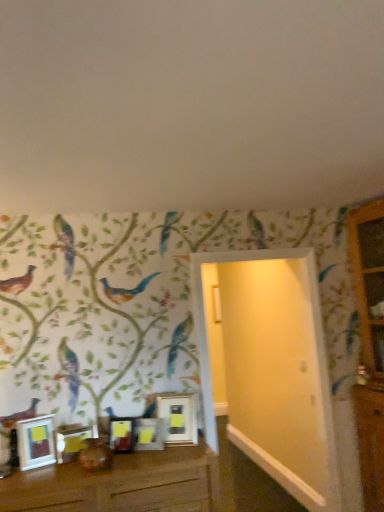
What is the approximate height of metallic silver frame at center, which ranks as the 4th picture frame in left-to-right order?

metallic silver frame at center, which ranks as the 4th picture frame in left-to-right order, is 9.89 inches in height.

The height and width of the screenshot is (512, 384). What are the coordinates of `metallic silver frame at center, which ranks as the 2th picture frame in right-to-left order` in the screenshot? It's located at (149, 434).

Describe the element at coordinates (72, 441) in the screenshot. I see `matte silver picture frame at lower left, which ranks as the second picture frame in left-to-right order` at that location.

Where is `brown wooden table at lower center`? This screenshot has width=384, height=512. brown wooden table at lower center is located at coordinates (121, 484).

Where is `metallic silver picture frame at center, the 1th picture frame viewed from the right`? This screenshot has height=512, width=384. metallic silver picture frame at center, the 1th picture frame viewed from the right is located at coordinates click(178, 418).

Is matte silver picture frame at lower left, which ranks as the second picture frame in left-to-right order, wider than white glossy picture frame at lower left, acting as the 5th picture frame starting from the right?

Incorrect, the width of matte silver picture frame at lower left, which ranks as the second picture frame in left-to-right order, does not surpass that of white glossy picture frame at lower left, acting as the 5th picture frame starting from the right.

Which is closer, (68, 436) or (28, 466)?

Point (68, 436).

Can white glossy picture frame at lower left, the 1th picture frame positioned from the left, be found inside matte silver picture frame at lower left, which ranks as the second picture frame in left-to-right order?

No, white glossy picture frame at lower left, the 1th picture frame positioned from the left, is not inside matte silver picture frame at lower left, which ranks as the second picture frame in left-to-right order.

Between wooden dresser at right and matte brown vase at center, which one has more height?

wooden dresser at right is taller.

Find the location of `vase in front of the wooden dresser at right`. vase in front of the wooden dresser at right is located at coordinates (95, 455).

From the image's perspective, is wooden dresser at right positioned above or below matte brown vase at center?

From the image's perspective, wooden dresser at right appears above matte brown vase at center.

From the image's perspective, is metallic silver frame at center, which ranks as the 2th picture frame in right-to-left order, located above or below white wooden door at center?

From the image's perspective, metallic silver frame at center, which ranks as the 2th picture frame in right-to-left order, appears below white wooden door at center.

Is point (136, 447) closer to viewer compared to point (327, 441)?

Yes, it is.

In order to click on door located on the right of metallic silver frame at center, which ranks as the 2th picture frame in right-to-left order in this screenshot , I will do `click(285, 375)`.

Are metallic silver frame at center, which ranks as the 4th picture frame in left-to-right order, and white wooden door at center making contact?

metallic silver frame at center, which ranks as the 4th picture frame in left-to-right order, is not next to white wooden door at center, and they're not touching.

Would you consider matte brown vase at center to be distant from matte silver picture frame at center, which is the 3th picture frame in right-to-left order?

No, matte brown vase at center is not far away from matte silver picture frame at center, which is the 3th picture frame in right-to-left order.

Considering the points (85, 454) and (116, 422), which point is in front, point (85, 454) or point (116, 422)?

The point (85, 454) is closer.

Considering the sizes of objects matte brown vase at center and matte silver picture frame at center, arranged as the 3th picture frame when viewed from the left, in the image provided, who is taller, matte brown vase at center or matte silver picture frame at center, arranged as the 3th picture frame when viewed from the left,?

matte silver picture frame at center, arranged as the 3th picture frame when viewed from the left.

From the image's perspective, is matte brown vase at center above or below white glossy picture frame at lower left, the 1th picture frame positioned from the left?

Based on their image positions, matte brown vase at center is located beneath white glossy picture frame at lower left, the 1th picture frame positioned from the left.

Between matte brown vase at center and white glossy picture frame at lower left, the 1th picture frame positioned from the left, which one has larger size?

white glossy picture frame at lower left, the 1th picture frame positioned from the left.

Is matte brown vase at center positioned with its back to white glossy picture frame at lower left, the 1th picture frame positioned from the left?

No, matte brown vase at center is not facing away from white glossy picture frame at lower left, the 1th picture frame positioned from the left.

From a real-world perspective, who is located higher, matte silver picture frame at center, arranged as the 3th picture frame when viewed from the left, or white glossy picture frame at lower left, acting as the 5th picture frame starting from the right?

white glossy picture frame at lower left, acting as the 5th picture frame starting from the right, is physically above.

Would you say matte silver picture frame at center, arranged as the 3th picture frame when viewed from the left, is inside or outside white glossy picture frame at lower left, the 1th picture frame positioned from the left?

matte silver picture frame at center, arranged as the 3th picture frame when viewed from the left, exists outside the volume of white glossy picture frame at lower left, the 1th picture frame positioned from the left.

From the image's perspective, is matte silver picture frame at center, which is the 3th picture frame in right-to-left order, below white glossy picture frame at lower left, the 1th picture frame positioned from the left?

Yes, from the image's perspective, matte silver picture frame at center, which is the 3th picture frame in right-to-left order, is below white glossy picture frame at lower left, the 1th picture frame positioned from the left.

Could you tell me if matte silver picture frame at center, arranged as the 3th picture frame when viewed from the left, is turned towards white glossy picture frame at lower left, the 1th picture frame positioned from the left?

No.

There is a matte silver picture frame at lower left, which appears as the fourth picture frame when viewed from the right. Identify the location of the 2nd picture frame above it (from the image's perspective). The image size is (384, 512). (149, 434).

Is metallic silver frame at center, which ranks as the 2th picture frame in right-to-left order, surrounded by matte silver picture frame at lower left, which appears as the fourth picture frame when viewed from the right?

No.

In the scene shown: Between matte silver picture frame at lower left, which ranks as the second picture frame in left-to-right order, and metallic silver frame at center, which ranks as the 4th picture frame in left-to-right order, which one appears on the left side from the viewer's perspective?

From the viewer's perspective, matte silver picture frame at lower left, which ranks as the second picture frame in left-to-right order, appears more on the left side.

From the image's perspective, which is below, matte silver picture frame at lower left, which ranks as the second picture frame in left-to-right order, or metallic silver frame at center, which ranks as the 4th picture frame in left-to-right order?

matte silver picture frame at lower left, which ranks as the second picture frame in left-to-right order, is shown below in the image.

This screenshot has width=384, height=512. Identify the location of the 3rd picture frame above when counting from the matte silver picture frame at lower left, which appears as the fourth picture frame when viewed from the right (from the image's perspective). (36, 442).

Locate an element on the screen. vase below the wooden dresser at right (from the image's perspective) is located at coordinates (95, 455).

From the image, which object appears to be farther from matte silver picture frame at lower left, which ranks as the second picture frame in left-to-right order, metallic silver picture frame at center, the fifth picture frame when ordered from left to right, or wooden dresser at right?

wooden dresser at right lies further to matte silver picture frame at lower left, which ranks as the second picture frame in left-to-right order, than the other object.

Based on their spatial positions, is matte silver picture frame at center, which is the 3th picture frame in right-to-left order, or matte silver picture frame at lower left, which ranks as the second picture frame in left-to-right order, further from matte brown vase at center?

The object further to matte brown vase at center is matte silver picture frame at lower left, which ranks as the second picture frame in left-to-right order.

Estimate the real-world distances between objects in this image. Which object is further from brown wooden table at lower center, wooden dresser at right or matte brown vase at center?

wooden dresser at right lies further to brown wooden table at lower center than the other object.

Which object lies further to the anchor point metallic silver picture frame at center, the fifth picture frame when ordered from left to right, white wooden door at center or brown wooden table at lower center?

The object further to metallic silver picture frame at center, the fifth picture frame when ordered from left to right, is white wooden door at center.

From the image, which object appears to be nearer to matte silver picture frame at center, which is the 3th picture frame in right-to-left order, brown wooden table at lower center or white glossy picture frame at lower left, the 1th picture frame positioned from the left?

brown wooden table at lower center lies closer to matte silver picture frame at center, which is the 3th picture frame in right-to-left order, than the other object.

Which object lies nearer to the anchor point matte silver picture frame at lower left, which appears as the fourth picture frame when viewed from the right, matte brown vase at center or white glossy picture frame at lower left, the 1th picture frame positioned from the left?

white glossy picture frame at lower left, the 1th picture frame positioned from the left.

Looking at the image, which one is located closer to matte brown vase at center, matte silver picture frame at center, which is the 3th picture frame in right-to-left order, or brown wooden table at lower center?

Among the two, matte silver picture frame at center, which is the 3th picture frame in right-to-left order, is located nearer to matte brown vase at center.

From the picture: Estimate the real-world distances between objects in this image. Which object is closer to wooden dresser at right, metallic silver picture frame at center, the 1th picture frame viewed from the right, or white wooden door at center?

white wooden door at center is positioned closer to the anchor wooden dresser at right.

I want to click on vase between matte silver picture frame at lower left, which appears as the fourth picture frame when viewed from the right, and metallic silver frame at center, which ranks as the 2th picture frame in right-to-left order, from left to right, so click(95, 455).

The image size is (384, 512). I want to click on door between matte silver picture frame at center, which is the 3th picture frame in right-to-left order, and wooden dresser at right, in the horizontal direction, so pos(285,375).

Locate an element on the screen. vase between brown wooden table at lower center and matte silver picture frame at center, which is the 3th picture frame in right-to-left order, along the z-axis is located at coordinates (95, 455).

Where is `door between matte silver picture frame at lower left, which ranks as the second picture frame in left-to-right order, and wooden dresser at right, in the horizontal direction`? Image resolution: width=384 pixels, height=512 pixels. door between matte silver picture frame at lower left, which ranks as the second picture frame in left-to-right order, and wooden dresser at right, in the horizontal direction is located at coordinates (285, 375).